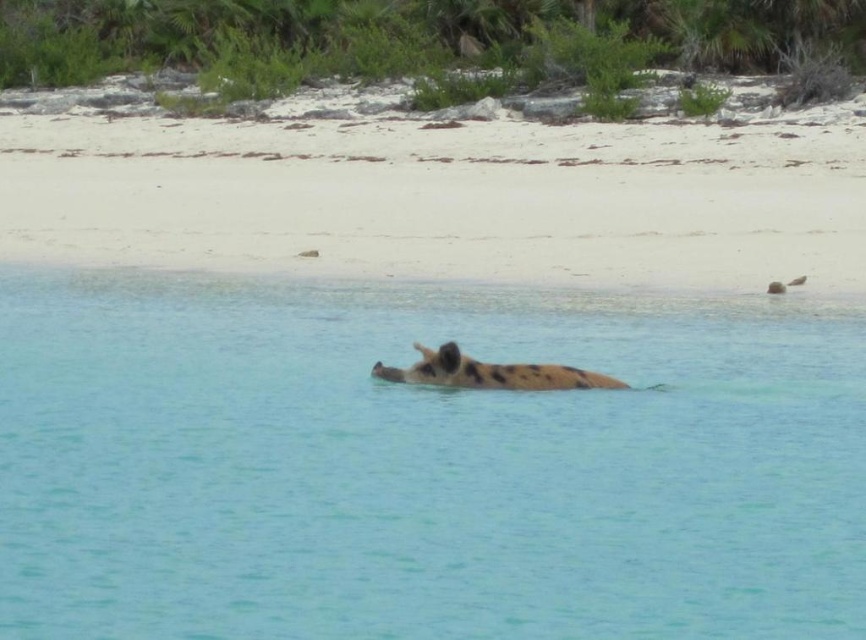
Question: Which object appears farthest from the camera in this image?

Choices:
 (A) clear blue water at center
 (B) white sand beach at center

Answer: (B)

Question: Does clear blue water at center have a greater width compared to spotted fur animal at center?

Choices:
 (A) yes
 (B) no

Answer: (A)

Question: Can you confirm if white sand beach at center is positioned to the right of spotted fur animal at center?

Choices:
 (A) yes
 (B) no

Answer: (A)

Question: Which object is the closest to the clear blue water at center?

Choices:
 (A) spotted fur animal at center
 (B) white sand beach at center

Answer: (A)

Question: Which object is closer to the camera taking this photo?

Choices:
 (A) spotted fur animal at center
 (B) white sand beach at center
 (C) clear blue water at center

Answer: (C)

Question: Is clear blue water at center smaller than white sand beach at center?

Choices:
 (A) no
 (B) yes

Answer: (B)